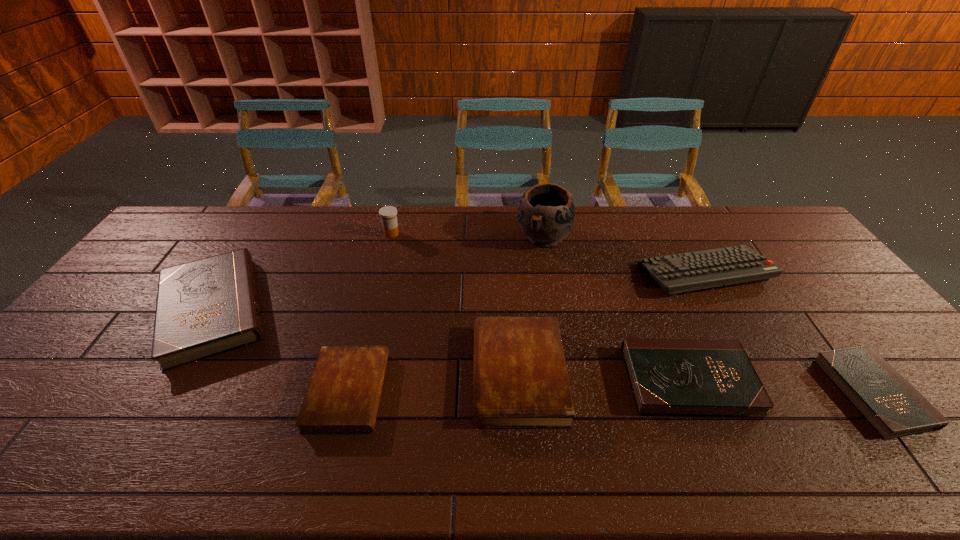
Where is `free space that is in between the pottery and the seventh shortest object`? Image resolution: width=960 pixels, height=540 pixels. free space that is in between the pottery and the seventh shortest object is located at coordinates (468, 235).

I want to click on empty space between the left reddish-brown Bible and the second tallest object, so click(x=370, y=313).

Image resolution: width=960 pixels, height=540 pixels. Find the location of `vacant area that lies between the bigger reddish-brown Bible and the computer keyboard`. vacant area that lies between the bigger reddish-brown Bible and the computer keyboard is located at coordinates (612, 323).

This screenshot has height=540, width=960. What are the coordinates of `vacant region between the smaller reddish-brown Bible and the blue pottery` in the screenshot? It's located at (445, 314).

Where is `vacant point located between the second tallest object and the bigger reddish-brown Bible`? vacant point located between the second tallest object and the bigger reddish-brown Bible is located at coordinates (455, 304).

Locate an element on the screen. object that stands as the second closest to the seventh shortest object is located at coordinates (546, 213).

The width and height of the screenshot is (960, 540). Identify the location of the sixth closest object to the orange medicine. (669, 377).

Choose which Bible is the fourth nearest neighbor to the fourth Bible from left to right. Please provide its 2D coordinates. Your answer should be formatted as a tuple, i.e. [(x, y)], where the tuple contains the x and y coordinates of a point satisfying the conditions above.

[(206, 307)]

Find the location of a particular element. This screenshot has width=960, height=540. Bible that is the second nearest to the second smallest green Bible is located at coordinates (890, 404).

Point out which green Bible is positioned as the second nearest to the second green Bible from left to right. Please provide its 2D coordinates. Your answer should be formatted as a tuple, i.e. [(x, y)], where the tuple contains the x and y coordinates of a point satisfying the conditions above.

[(206, 307)]